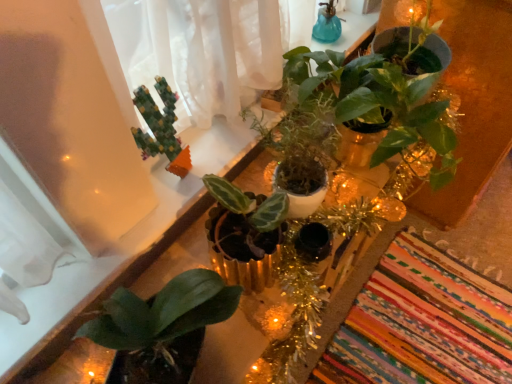
Locate an element on the screen. free spot below multicolored woven mat at lower right (from a real-world perspective) is located at coordinates (415, 321).